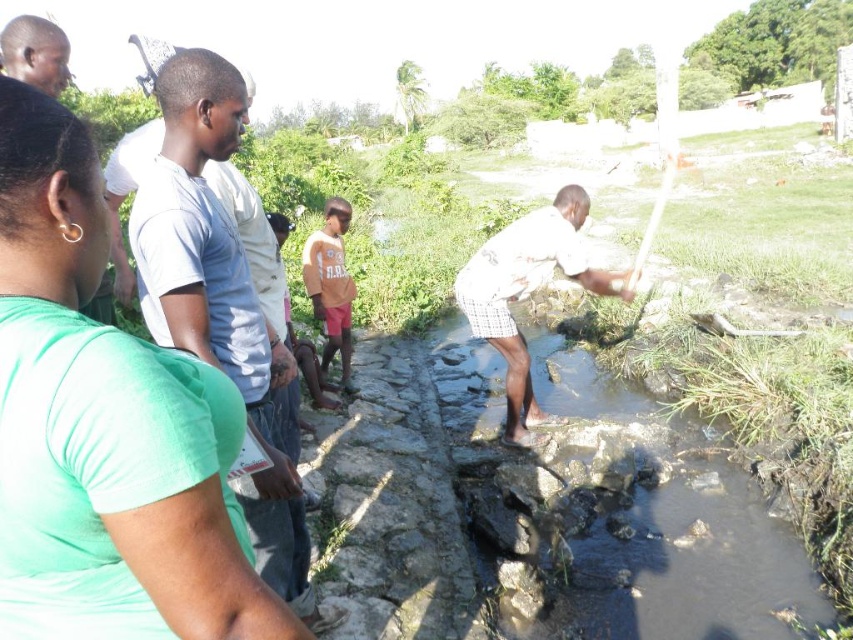
Question: Is green matte shirt at left smaller than white checkered shorts at center?

Choices:
 (A) yes
 (B) no

Answer: (A)

Question: Is dark gray stone stream at center in front of white checkered shorts at center?

Choices:
 (A) yes
 (B) no

Answer: (A)

Question: Which is farther from the white checkered shorts at center?

Choices:
 (A) brown fabric shorts at center
 (B) green matte shirt at left
 (C) matte black shirt at upper left

Answer: (B)

Question: Which point is closer to the camera?

Choices:
 (A) (44, 442)
 (B) (36, 38)
 (C) (496, 241)

Answer: (A)

Question: Is brown fabric shorts at center positioned behind matte black shirt at upper left?

Choices:
 (A) yes
 (B) no

Answer: (A)

Question: Which object is positioned farthest from the green matte shirt at left?

Choices:
 (A) white checkered shorts at center
 (B) matte black shirt at upper left
 (C) dark gray stone stream at center

Answer: (A)